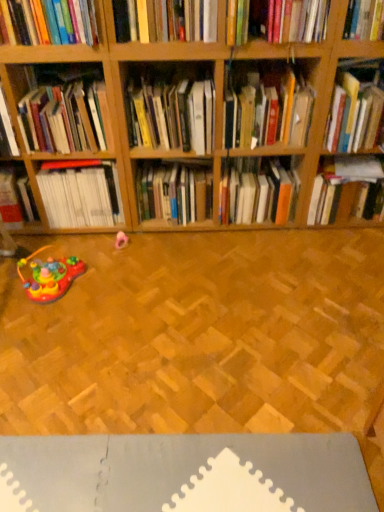
Where is `vacant space situated above hardcover book at upper right, placed as the eleventh book when sorted from left to right (from a real-world perspective)`? vacant space situated above hardcover book at upper right, placed as the eleventh book when sorted from left to right (from a real-world perspective) is located at coordinates (355, 167).